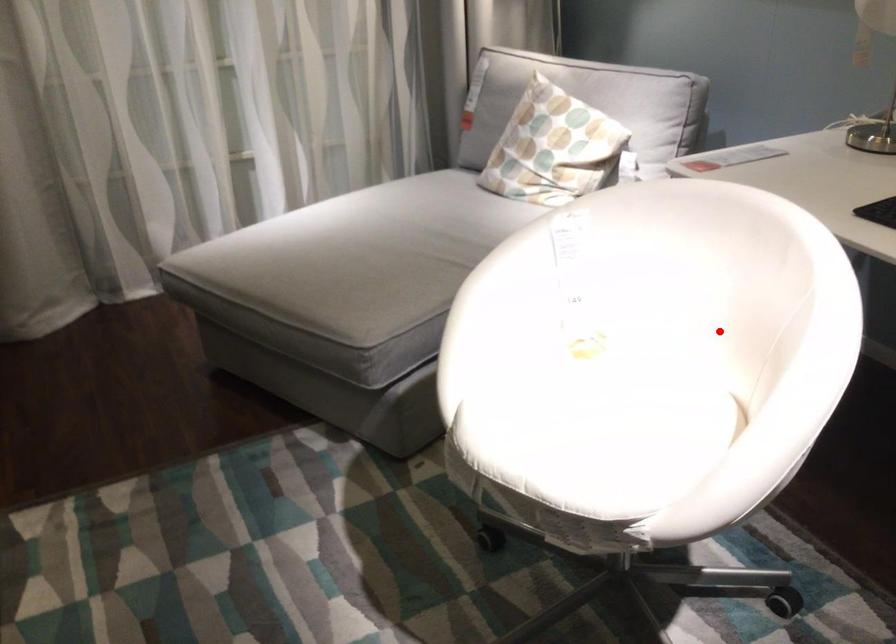
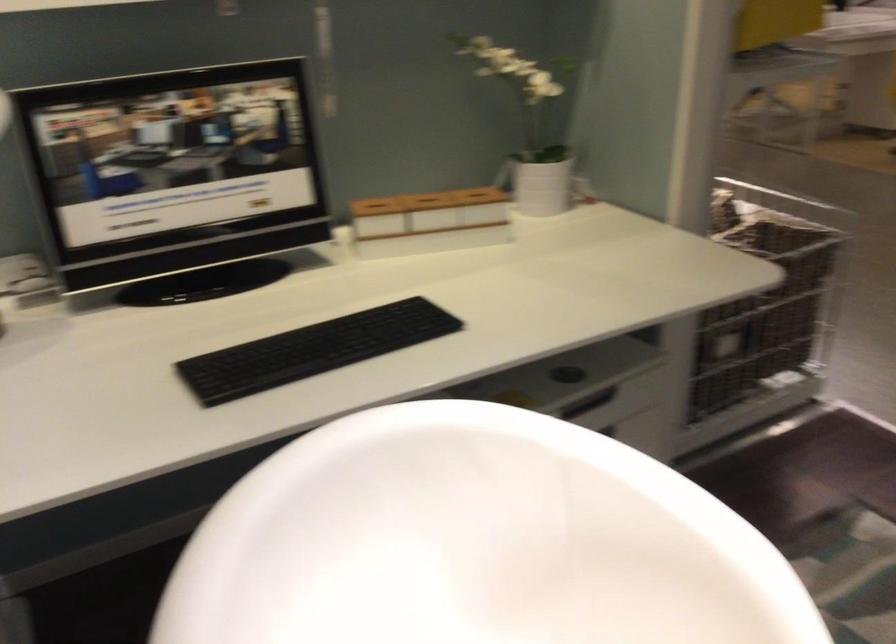
Question: I am providing you with two images of the same scene from different viewpoints. A red point is marked on the first image. Can you still see the location of the red point in image 2?

Choices:
 (A) Yes
 (B) No

Answer: (A)